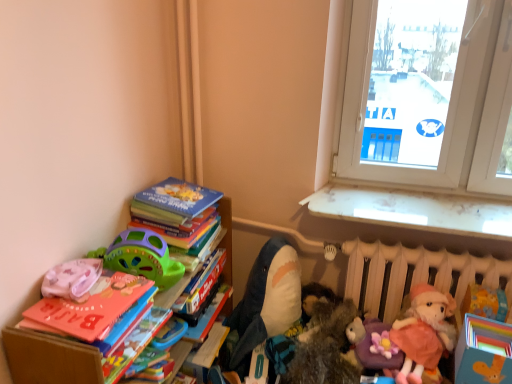
Where is `vacant area that lies to the right of pink fabric pillow at left, which is counted as the 6th toy, starting from the right`? The width and height of the screenshot is (512, 384). vacant area that lies to the right of pink fabric pillow at left, which is counted as the 6th toy, starting from the right is located at coordinates (124, 286).